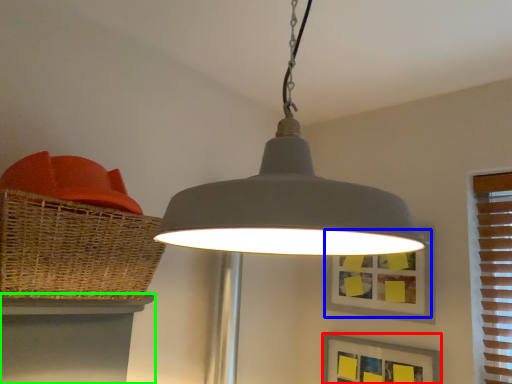
Question: Which object is the farthest from picture frame (highlighted by a red box)? Choose among these: picture frame (highlighted by a blue box) or table (highlighted by a green box).

Choices:
 (A) picture frame
 (B) table

Answer: (B)